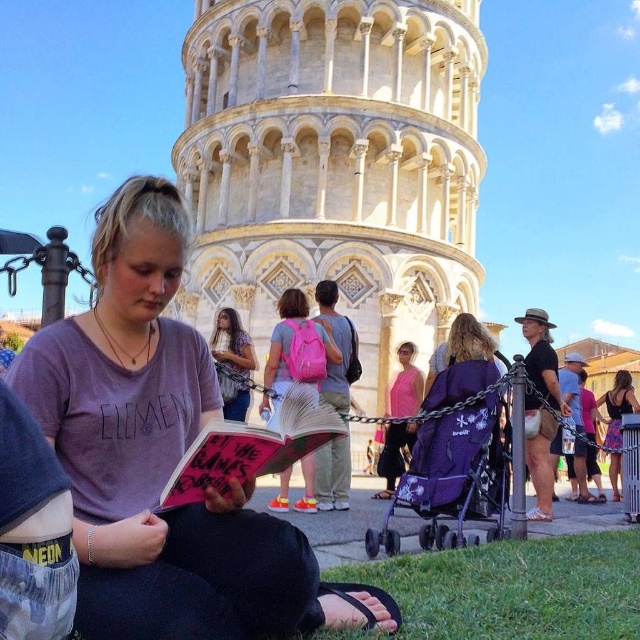
In the scene shown: You are a photographer planning to take a portrait of the woman in the scene. You want to ensure that both the pink fabric dress at center and the denim jacket at center are visible in the frame. Which clothing item should you focus on to ensure both are in the shot?

The pink fabric dress at center is taller than the denim jacket at center, so focusing on the pink fabric dress at center will ensure both items are visible in the frame.

You are a tourist visiting the Leaning Tower of Pisa and see the pink fabric backpack at center and the denim jacket at center. Which item is taller?

The pink fabric backpack at center is much taller than the denim jacket at center.

From the picture: You are a photographer planning to take a portrait of the woman in the scene. You want to ensure her clothing items are visible. Which clothing item, the pink fabric dress at center or the denim jacket at center, should you focus on to capture it in a lower part of the image?

The pink fabric dress at center is below the denim jacket at center, so focusing on the lower part of the image will capture the pink fabric dress at center.